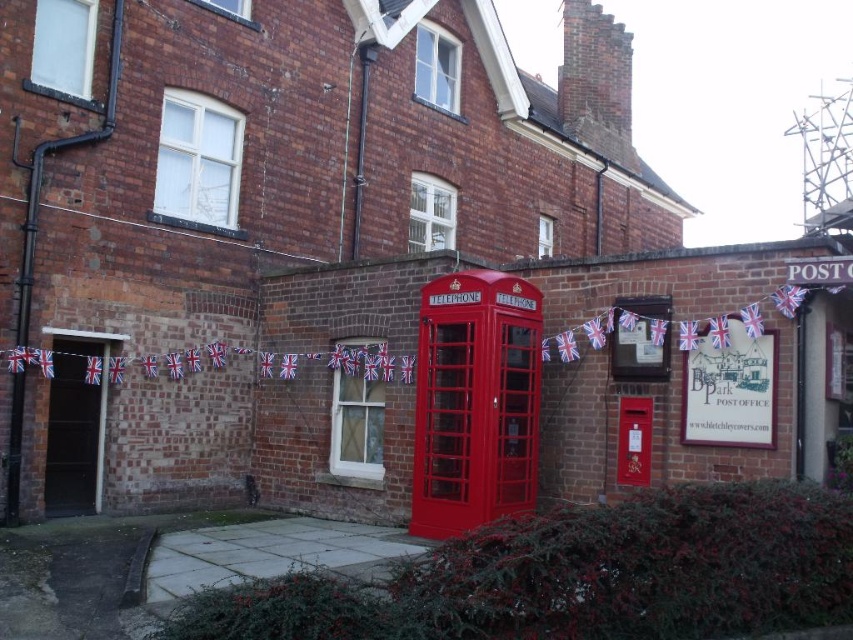
Question: Which object appears farthest from the camera in this image?

Choices:
 (A) metallic red telephone box at center
 (B) matte red telephone box at center

Answer: (A)

Question: Can you confirm if matte red telephone box at center is smaller than metallic red telephone box at center?

Choices:
 (A) no
 (B) yes

Answer: (A)

Question: Does matte red telephone box at center have a larger size compared to metallic red telephone box at center?

Choices:
 (A) yes
 (B) no

Answer: (A)

Question: Which point is closer to the camera?

Choices:
 (A) (627, 401)
 (B) (477, 333)

Answer: (B)

Question: Does matte red telephone box at center appear over metallic red telephone box at center?

Choices:
 (A) yes
 (B) no

Answer: (A)